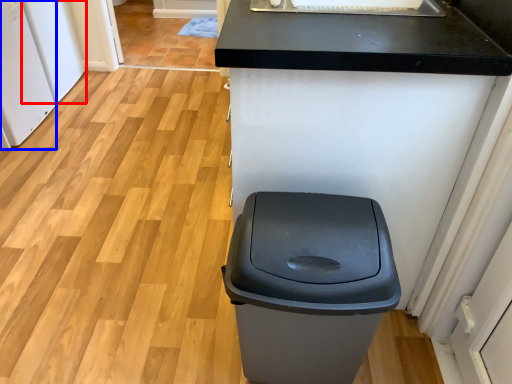
Question: Among these objects, which one is nearest to the camera, appliance (highlighted by a red box) or appliance (highlighted by a blue box)?

Choices:
 (A) appliance
 (B) appliance

Answer: (B)